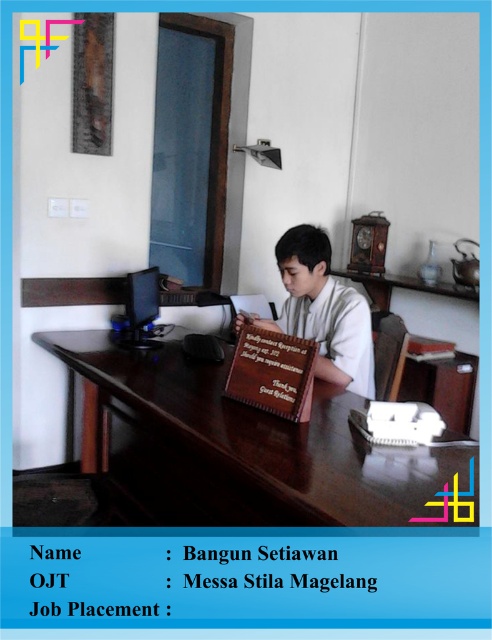
You are a guest in this office and need to place a small item on the brown wooden table at center. The item is 15 inches long. Will it fit on the table without overlapping the wooden plaque at center?

The brown wooden table at center is 15.36 inches away from the wooden plaque at center. Since the item is 15 inches long, it can be placed on the table without overlapping the plaque as there is enough space between them.

Based on the photo, you are a guest standing in front of the brown wooden table at center. You want to place a 1.2 meter long gift box on the table. Can you do that?

The brown wooden table at center is 1.11 meters away from the camera, but this distance does not indicate the table length. Therefore, it is unclear if the table can accommodate the 1.2 meter long gift box.

You are a guest in this office and need to read the message on the wooden plaque at center. Can you see the matte black monitor at center behind it?

Yes, the wooden plaque at center is in front of the matte black monitor at center, so the monitor is visible behind it.